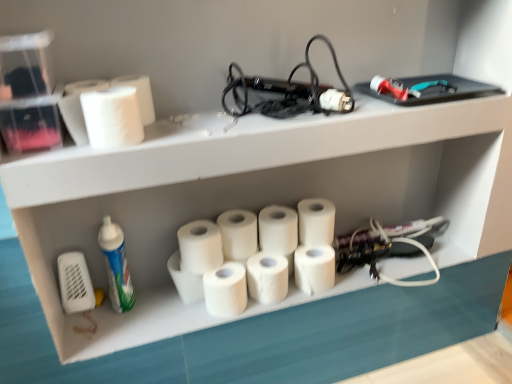
Question: Considering the positions of white matte paper towel at upper left, arranged as the first paper towel when viewed from the left, and white matte paper towel at center, arranged as the sixth paper towel when viewed from the right, in the image, is white matte paper towel at upper left, arranged as the first paper towel when viewed from the left, taller or shorter than white matte paper towel at center, arranged as the sixth paper towel when viewed from the right,?

Choices:
 (A) short
 (B) tall

Answer: (A)

Question: Choose the correct answer: Is white matte paper towel at upper left, which ranks as the 10th paper towel in right-to-left order, inside white matte paper towel at center, arranged as the sixth paper towel when viewed from the right, or outside it?

Choices:
 (A) outside
 (B) inside

Answer: (A)

Question: Which object is the farthest from the white matte paper towel at center, arranged as the sixth paper towel when viewed from the right?

Choices:
 (A) white matte paper towel at center, arranged as the seventh paper towel when viewed from the right
 (B) blue-green plastic cleaning product at lower left
 (C) white matte paper towel at upper left, the 9th paper towel positioned from the right
 (D) white matte paper towel at center, the 5th paper towel viewed from the right
 (E) white matte paper towel at upper left, arranged as the first paper towel when viewed from the left

Answer: (E)

Question: Which is nearer to the white matte paper towel at center, the 9th paper towel from the left?

Choices:
 (A) white matte paper towel at center, the 8th paper towel in the right-to-left sequence
 (B) white matte paper towel at upper left, the 9th paper towel positioned from the right
 (C) white matte paper towel at center, the 4th paper towel positioned from the right
 (D) white matte paper towel at center, the 5th paper towel from the left
 (E) white matte paper towel at center, which appears as the eighth paper towel when viewed from the left

Answer: (E)